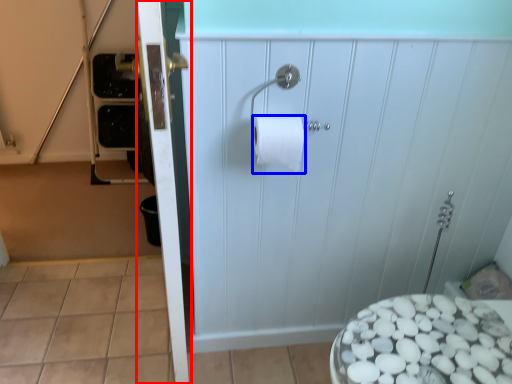
Question: Which of the following is the farthest to the observer, screen door (highlighted by a red box) or toilet paper (highlighted by a blue box)?

Choices:
 (A) screen door
 (B) toilet paper

Answer: (B)